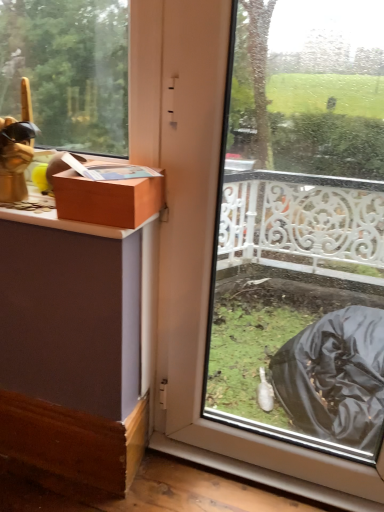
Locate an element on the screen. transparent plastic bag at lower right is located at coordinates (210, 277).

What do you see at coordinates (210, 277) in the screenshot?
I see `transparent plastic bag at lower right` at bounding box center [210, 277].

Find the location of a particular element. The width and height of the screenshot is (384, 512). matte brown box at upper left is located at coordinates (107, 199).

What do you see at coordinates (107, 199) in the screenshot?
I see `matte brown box at upper left` at bounding box center [107, 199].

Where is `transparent plastic bag at lower right`? transparent plastic bag at lower right is located at coordinates click(x=210, y=277).

Which is more to the left, transparent plastic bag at lower right or matte brown box at upper left?

matte brown box at upper left is more to the left.

Does transparent plastic bag at lower right come behind matte brown box at upper left?

No.

Which is nearer, (164, 88) or (118, 221)?

Clearly, point (164, 88) is more distant from the camera than point (118, 221).

From the image's perspective, which object appears higher, transparent plastic bag at lower right or matte brown box at upper left?

From the image's view, matte brown box at upper left is above.

From a real-world perspective, is transparent plastic bag at lower right on top of matte brown box at upper left?

No.

Which object is thinner, transparent plastic bag at lower right or matte brown box at upper left?

transparent plastic bag at lower right is thinner.

Is transparent plastic bag at lower right shorter than matte brown box at upper left?

Incorrect, the height of transparent plastic bag at lower right does not fall short of that of matte brown box at upper left.

Considering the relative sizes of transparent plastic bag at lower right and matte brown box at upper left in the image provided, is transparent plastic bag at lower right bigger than matte brown box at upper left?

Correct, transparent plastic bag at lower right is larger in size than matte brown box at upper left.

Would you say transparent plastic bag at lower right is outside matte brown box at upper left?

transparent plastic bag at lower right is positioned outside matte brown box at upper left.

Is transparent plastic bag at lower right touching matte brown box at upper left?

No, transparent plastic bag at lower right is not next to matte brown box at upper left.

Is transparent plastic bag at lower right aimed at matte brown box at upper left?

No, transparent plastic bag at lower right is not aimed at matte brown box at upper left.

Looking at this image, what's the angular difference between transparent plastic bag at lower right and matte brown box at upper left's facing directions?

0.325 degrees separate the facing orientations of transparent plastic bag at lower right and matte brown box at upper left.

Measure the distance from transparent plastic bag at lower right to matte brown box at upper left.

transparent plastic bag at lower right and matte brown box at upper left are 32.84 centimeters apart.

At what (x,y) coordinates should I click in order to perform the action: click on glass door in front of the matte brown box at upper left. Please return your answer as a coordinate pair (x, y). The image size is (384, 512). Looking at the image, I should click on (210, 277).

Considering the relative positions of matte brown box at upper left and transparent plastic bag at lower right in the image provided, is matte brown box at upper left to the left or to the right of transparent plastic bag at lower right?

matte brown box at upper left is to the left of transparent plastic bag at lower right.

Considering the positions of objects matte brown box at upper left and transparent plastic bag at lower right in the image provided, who is behind, matte brown box at upper left or transparent plastic bag at lower right?

matte brown box at upper left is more distant.

Considering the points (98, 221) and (211, 89), which point is behind, point (98, 221) or point (211, 89)?

Positioned behind is point (211, 89).

From the image's perspective, is matte brown box at upper left on transparent plastic bag at lower right?

Yes, from the image's perspective, matte brown box at upper left is above transparent plastic bag at lower right.

From a real-world perspective, is matte brown box at upper left on transparent plastic bag at lower right?

Yes.

Does matte brown box at upper left have a greater width compared to transparent plastic bag at lower right?

Correct, the width of matte brown box at upper left exceeds that of transparent plastic bag at lower right.

Does matte brown box at upper left have a greater height compared to transparent plastic bag at lower right?

No.

Between matte brown box at upper left and transparent plastic bag at lower right, which one has smaller size?

With smaller size is matte brown box at upper left.

Is matte brown box at upper left spatially inside transparent plastic bag at lower right, or outside of it?

matte brown box at upper left cannot be found inside transparent plastic bag at lower right.

Are matte brown box at upper left and transparent plastic bag at lower right far apart?

They are positioned close to each other.

Is matte brown box at upper left facing away from transparent plastic bag at lower right?

No, transparent plastic bag at lower right is not at the back of matte brown box at upper left.

Can you tell me how much matte brown box at upper left and transparent plastic bag at lower right differ in facing direction?

The angular difference between matte brown box at upper left and transparent plastic bag at lower right is 0.325 degrees.

You are a GUI agent. You are given a task and a screenshot of the screen. Output one action in this format:
    pyautogui.click(x=<x>, y=<y>)
    Task: Click on the box on the left of transparent plastic bag at lower right
    Image resolution: width=384 pixels, height=512 pixels.
    Given the screenshot: What is the action you would take?
    pyautogui.click(x=107, y=199)

Image resolution: width=384 pixels, height=512 pixels. In order to click on box above the transparent plastic bag at lower right (from a real-world perspective) in this screenshot , I will do `click(107, 199)`.

In the image, there is a transparent plastic bag at lower right. Identify the location of box above it (from the image's perspective). (107, 199).